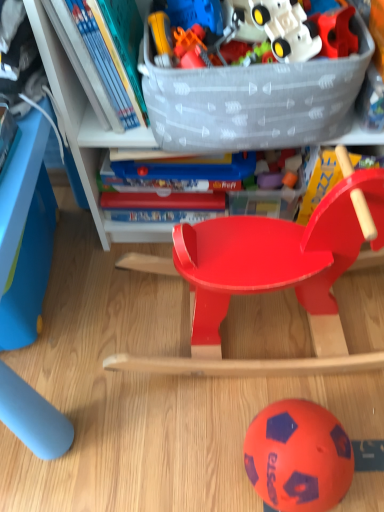
Describe the element at coordinates (25, 234) in the screenshot. I see `blue plastic table at lower left` at that location.

The image size is (384, 512). I want to click on blue plastic table at lower left, so click(x=25, y=234).

The image size is (384, 512). What do you see at coordinates (252, 100) in the screenshot?
I see `translucent plastic storage box at upper center` at bounding box center [252, 100].

At what (x,y) coordinates should I click in order to perform the action: click on orange rubber ball at lower center. Please return your answer as a coordinate pair (x, y). Looking at the image, I should click on (298, 456).

Locate an element on the screen. The image size is (384, 512). glossy plastic rocking horse at center is located at coordinates (268, 279).

Where is `blue plastic table at lower left`? This screenshot has width=384, height=512. blue plastic table at lower left is located at coordinates (25, 234).

From the image's perspective, is orange rubber ball at lower center above or below rubberized plastic puzzle piece at upper right?

orange rubber ball at lower center is below rubberized plastic puzzle piece at upper right.

From the picture: Can you confirm if orange rubber ball at lower center is taller than rubberized plastic puzzle piece at upper right?

Yes.

Can you confirm if orange rubber ball at lower center is smaller than rubberized plastic puzzle piece at upper right?

Incorrect, orange rubber ball at lower center is not smaller in size than rubberized plastic puzzle piece at upper right.

Based on their positions, is orange rubber ball at lower center located to the left or right of rubberized plastic puzzle piece at upper right?

From the image, it's evident that orange rubber ball at lower center is to the left of rubberized plastic puzzle piece at upper right.

Is point (310, 19) less distant than point (115, 67)?

Yes, point (310, 19) is in front of point (115, 67).

Considering the sizes of objects rubberized plastic puzzle piece at upper right and hardcover book at upper left in the image provided, who is wider, rubberized plastic puzzle piece at upper right or hardcover book at upper left?

hardcover book at upper left is wider.

Is rubberized plastic puzzle piece at upper right facing towards hardcover book at upper left?

No, rubberized plastic puzzle piece at upper right is not turned towards hardcover book at upper left.

Is rubberized plastic puzzle piece at upper right situated inside hardcover book at upper left or outside?

rubberized plastic puzzle piece at upper right lies outside hardcover book at upper left.

From a real-world perspective, is glossy plastic rocking horse at center physically located above or below matte plastic bookcase at upper center?

glossy plastic rocking horse at center is situated lower than matte plastic bookcase at upper center in the real world.

Consider the image. Is glossy plastic rocking horse at center far from matte plastic bookcase at upper center?

That's not correct — glossy plastic rocking horse at center is a little close to matte plastic bookcase at upper center.

Which point is more distant from viewer, (368, 358) or (51, 79)?

The point (368, 358) is farther from the camera.

Considering the relative sizes of glossy plastic rocking horse at center and matte plastic bookcase at upper center in the image provided, is glossy plastic rocking horse at center bigger than matte plastic bookcase at upper center?

Actually, glossy plastic rocking horse at center might be smaller than matte plastic bookcase at upper center.

Is glossy plastic rocking horse at center turned away from orange rubber ball at lower center?

No, glossy plastic rocking horse at center is not facing away from orange rubber ball at lower center.

Which of these two, glossy plastic rocking horse at center or orange rubber ball at lower center, is thinner?

Thinner between the two is orange rubber ball at lower center.

How different are the orientations of glossy plastic rocking horse at center and orange rubber ball at lower center in degrees?

There is a 0.261-degree angle between the facing directions of glossy plastic rocking horse at center and orange rubber ball at lower center.

Does blue plastic table at lower left appear on the right side of matte plastic bookcase at upper center?

No.

Is point (7, 274) closer or farther from the camera than point (86, 175)?

Clearly, point (7, 274) is closer to the camera than point (86, 175).

Is blue plastic table at lower left next to matte plastic bookcase at upper center?

No, blue plastic table at lower left is not with matte plastic bookcase at upper center.

Considering the sizes of objects blue plastic table at lower left and matte plastic bookcase at upper center in the image provided, who is shorter, blue plastic table at lower left or matte plastic bookcase at upper center?

blue plastic table at lower left is shorter.

Is orange rubber ball at lower center positioned with its back to translucent plastic storage box at upper center?

orange rubber ball at lower center does not have its back to translucent plastic storage box at upper center.

Is orange rubber ball at lower center spatially inside translucent plastic storage box at upper center, or outside of it?

orange rubber ball at lower center cannot be found inside translucent plastic storage box at upper center.

Considering the sizes of orange rubber ball at lower center and translucent plastic storage box at upper center in the image, is orange rubber ball at lower center wider or thinner than translucent plastic storage box at upper center?

Clearly, orange rubber ball at lower center has less width compared to translucent plastic storage box at upper center.

Considering their positions, is hardcover book at upper left located in front of or behind glossy plastic rocking horse at center?

In the image, hardcover book at upper left appears behind glossy plastic rocking horse at center.

From a real-world perspective, is hardcover book at upper left on top of glossy plastic rocking horse at center?

Yes.

Between point (108, 44) and point (333, 247), which one is positioned behind?

The point (333, 247) is farther from the camera.

From the image's perspective, who appears lower, hardcover book at upper left or glossy plastic rocking horse at center?

glossy plastic rocking horse at center, from the image's perspective.

At what (x,y) coordinates should I click in order to perform the action: click on toy behind the orange rubber ball at lower center. Please return your answer as a coordinate pair (x, y). Looking at the image, I should click on (336, 32).

Find the location of a particular element. The height and width of the screenshot is (512, 384). book on the left side of rubberized plastic puzzle piece at upper right is located at coordinates (114, 55).

When comparing their distances from translucent plastic storage box at upper center, does glossy plastic rocking horse at center or orange rubber ball at lower center seem closer?

Based on the image, glossy plastic rocking horse at center appears to be nearer to translucent plastic storage box at upper center.

Consider the image. Estimate the real-world distances between objects in this image. Which object is further from orange rubber ball at lower center, matte plastic bookcase at upper center or hardcover book at upper left?

hardcover book at upper left is further to orange rubber ball at lower center.

Estimate the real-world distances between objects in this image. Which object is closer to rubberized plastic puzzle piece at upper right, matte plastic bookcase at upper center or orange rubber ball at lower center?

The object closer to rubberized plastic puzzle piece at upper right is matte plastic bookcase at upper center.

Based on their spatial positions, is rubberized plastic puzzle piece at upper right or orange rubber ball at lower center closer to matte plastic bookcase at upper center?

rubberized plastic puzzle piece at upper right is closer to matte plastic bookcase at upper center.

From the picture: From the image, which object appears to be farther from hardcover book at upper left, glossy plastic rocking horse at center or blue plastic table at lower left?

glossy plastic rocking horse at center is positioned further to the anchor hardcover book at upper left.

Which object lies nearer to the anchor point translucent plastic storage box at upper center, orange rubber ball at lower center or matte plastic bookcase at upper center?

matte plastic bookcase at upper center is positioned closer to the anchor translucent plastic storage box at upper center.

Considering their positions, is hardcover book at upper left positioned closer to orange rubber ball at lower center than rubberized plastic puzzle piece at upper right?

rubberized plastic puzzle piece at upper right.

When comparing their distances from rubberized plastic puzzle piece at upper right, does hardcover book at upper left or orange rubber ball at lower center seem further?

orange rubber ball at lower center.

This screenshot has width=384, height=512. I want to click on chair between blue plastic table at lower left and matte plastic bookcase at upper center in the horizontal direction, so click(x=268, y=279).

This screenshot has width=384, height=512. I want to click on bookcase situated between translucent plastic storage box at upper center and rubberized plastic puzzle piece at upper right from left to right, so click(x=88, y=132).

The image size is (384, 512). I want to click on bookcase located between hardcover book at upper left and rubberized plastic puzzle piece at upper right in the left-right direction, so click(x=88, y=132).

Locate an element on the screen. bookcase between blue plastic table at lower left and rubberized plastic puzzle piece at upper right is located at coordinates (88, 132).